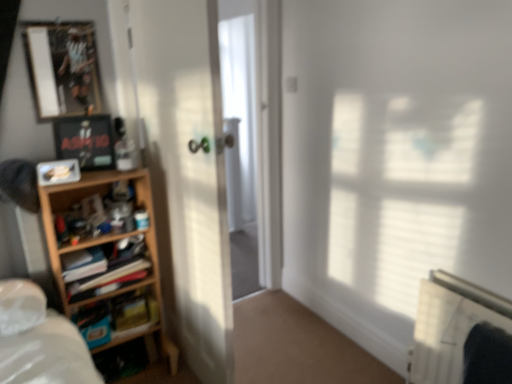
The height and width of the screenshot is (384, 512). Describe the element at coordinates (134, 311) in the screenshot. I see `hardcover book at left` at that location.

How much space does matte plastic picture frame at left, which ranks as the third picture frame in top-to-bottom order, occupy vertically?

It is 3.64 inches.

Identify the location of metallic silver picture frame at upper left, the first picture frame viewed from the top. The image size is (512, 384). (63, 68).

The image size is (512, 384). Describe the element at coordinates (63, 68) in the screenshot. I see `metallic silver picture frame at upper left, the first picture frame viewed from the top` at that location.

The image size is (512, 384). What do you see at coordinates (85, 141) in the screenshot?
I see `matte black picture frame at upper left, the second picture frame positioned from the bottom` at bounding box center [85, 141].

Where is `hardcover book at left`? This screenshot has width=512, height=384. hardcover book at left is located at coordinates (134, 311).

Is hardcover book at left oriented towards matte plastic picture frame at left, the 1th picture frame positioned from the bottom?

No, hardcover book at left is not aimed at matte plastic picture frame at left, the 1th picture frame positioned from the bottom.

Is hardcover book at left touching matte plastic picture frame at left, which ranks as the third picture frame in top-to-bottom order?

No, hardcover book at left is not touching matte plastic picture frame at left, which ranks as the third picture frame in top-to-bottom order.

Between hardcover book at left and matte plastic picture frame at left, which ranks as the third picture frame in top-to-bottom order, which one appears on the right side from the viewer's perspective?

Positioned to the right is hardcover book at left.

Looking at their sizes, would you say hardcover book at left is wider or thinner than matte plastic picture frame at left, the 1th picture frame positioned from the bottom?

Considering their sizes, hardcover book at left looks broader than matte plastic picture frame at left, the 1th picture frame positioned from the bottom.

Looking at this image, from the image's perspective, is metallic silver picture frame at upper left, the first picture frame viewed from the top, over matte plastic picture frame at left, the 1th picture frame positioned from the bottom?

Yes, from the image's perspective, metallic silver picture frame at upper left, the first picture frame viewed from the top, is over matte plastic picture frame at left, the 1th picture frame positioned from the bottom.

In terms of width, does metallic silver picture frame at upper left, the third picture frame positioned from the bottom, look wider or thinner when compared to matte plastic picture frame at left, the 1th picture frame positioned from the bottom?

In the image, metallic silver picture frame at upper left, the third picture frame positioned from the bottom, appears to be more narrow than matte plastic picture frame at left, the 1th picture frame positioned from the bottom.

Is metallic silver picture frame at upper left, the first picture frame viewed from the top, beside matte plastic picture frame at left, which ranks as the third picture frame in top-to-bottom order?

No, metallic silver picture frame at upper left, the first picture frame viewed from the top, is not in contact with matte plastic picture frame at left, which ranks as the third picture frame in top-to-bottom order.

Is metallic silver picture frame at upper left, the first picture frame viewed from the top, facing towards matte plastic picture frame at left, which ranks as the third picture frame in top-to-bottom order?

No.

Is white plastic radiator at lower right in contact with wooden shelf at left, which appears as the 2th shelf when ordered from the bottom?

No, white plastic radiator at lower right is not touching wooden shelf at left, which appears as the 2th shelf when ordered from the bottom.

Where is `shelf that is the 2nd object above the white plastic radiator at lower right (from a real-world perspective)`? Image resolution: width=512 pixels, height=384 pixels. shelf that is the 2nd object above the white plastic radiator at lower right (from a real-world perspective) is located at coordinates (112, 268).

Which is behind, point (445, 288) or point (78, 290)?

The point (78, 290) is farther.

Is white plastic radiator at lower right behind wooden shelf at left, the first shelf when ordered from top to bottom?

No, it is not.

Considering the sizes of objects hardcover book at left and metallic silver picture frame at upper left, the first picture frame viewed from the top, in the image provided, who is shorter, hardcover book at left or metallic silver picture frame at upper left, the first picture frame viewed from the top,?

hardcover book at left is shorter.

From the image's perspective, between hardcover book at left and metallic silver picture frame at upper left, the third picture frame positioned from the bottom, which one is located above?

From the image's view, metallic silver picture frame at upper left, the third picture frame positioned from the bottom, is above.

Can you confirm if hardcover book at left is smaller than metallic silver picture frame at upper left, the third picture frame positioned from the bottom?

Actually, hardcover book at left might be larger than metallic silver picture frame at upper left, the third picture frame positioned from the bottom.

Locate an element on the screen. paperback book below the metallic silver picture frame at upper left, the third picture frame positioned from the bottom (from a real-world perspective) is located at coordinates (134, 311).

Would you say hardcover book at left contains matte black picture frame at upper left, the second picture frame positioned from the bottom?

No, matte black picture frame at upper left, the second picture frame positioned from the bottom, is not a part of hardcover book at left.

Is hardcover book at left taller or shorter than matte black picture frame at upper left, acting as the 2th picture frame starting from the top?

hardcover book at left is shorter than matte black picture frame at upper left, acting as the 2th picture frame starting from the top.

Is hardcover book at left bigger than matte black picture frame at upper left, acting as the 2th picture frame starting from the top?

No, hardcover book at left is not bigger than matte black picture frame at upper left, acting as the 2th picture frame starting from the top.

Measure the distance from hardcover book at left to matte black picture frame at upper left, acting as the 2th picture frame starting from the top.

They are 28.87 inches apart.

Which object is wider, hardcover book at left or wooden shelf at left, the first shelf when ordered from top to bottom?

With larger width is wooden shelf at left, the first shelf when ordered from top to bottom.

From the picture: Is the depth of hardcover book at left less than that of wooden shelf at left, which appears as the 2th shelf when ordered from the bottom?

No, hardcover book at left is behind wooden shelf at left, which appears as the 2th shelf when ordered from the bottom.

Can you tell me how much hardcover book at left and wooden shelf at left, the first shelf when ordered from top to bottom, differ in facing direction?

The angle between the facing direction of hardcover book at left and the facing direction of wooden shelf at left, the first shelf when ordered from top to bottom, is 1.54 degrees.

From a real-world perspective, who is located lower, matte plastic picture frame at left, the 1th picture frame positioned from the bottom, or metallic silver picture frame at upper left, the third picture frame positioned from the bottom?

matte plastic picture frame at left, the 1th picture frame positioned from the bottom.

Is matte plastic picture frame at left, the 1th picture frame positioned from the bottom, to the left or to the right of metallic silver picture frame at upper left, the third picture frame positioned from the bottom, in the image?

In the image, matte plastic picture frame at left, the 1th picture frame positioned from the bottom, appears on the right side of metallic silver picture frame at upper left, the third picture frame positioned from the bottom.

Which is behind, point (39, 182) or point (67, 62)?

Positioned behind is point (67, 62).

Is matte plastic picture frame at left, the 1th picture frame positioned from the bottom, aimed at metallic silver picture frame at upper left, the third picture frame positioned from the bottom?

No, matte plastic picture frame at left, the 1th picture frame positioned from the bottom, is not aimed at metallic silver picture frame at upper left, the third picture frame positioned from the bottom.

There is a hardcover book at left. In order to click on the 1st picture frame above it (from the image's perspective) in this screenshot , I will do `click(58, 172)`.

The height and width of the screenshot is (384, 512). I want to click on the 1st picture frame behind the matte plastic picture frame at left, the 1th picture frame positioned from the bottom, starting your count from the anchor, so click(x=63, y=68).

Looking at the image, which one is located closer to hardcover book at left, white glossy screen door at center or wooden shelf at left, marked as the first shelf in a bottom-to-top arrangement?

Among the two, wooden shelf at left, marked as the first shelf in a bottom-to-top arrangement, is located nearer to hardcover book at left.

Estimate the real-world distances between objects in this image. Which object is closer to matte plastic picture frame at left, which ranks as the third picture frame in top-to-bottom order, white plastic radiator at lower right or matte black picture frame at upper left, acting as the 2th picture frame starting from the top?

matte black picture frame at upper left, acting as the 2th picture frame starting from the top.

Looking at this image, estimate the real-world distances between objects in this image. Which object is further from matte black picture frame at upper left, acting as the 2th picture frame starting from the top, matte plastic picture frame at left, which ranks as the third picture frame in top-to-bottom order, or wooden shelf at left, the first shelf when ordered from top to bottom?

wooden shelf at left, the first shelf when ordered from top to bottom, is positioned further to the anchor matte black picture frame at upper left, acting as the 2th picture frame starting from the top.

Based on their spatial positions, is hardcover book at left or white glossy screen door at center closer to matte plastic picture frame at left, which ranks as the third picture frame in top-to-bottom order?

Among the two, white glossy screen door at center is located nearer to matte plastic picture frame at left, which ranks as the third picture frame in top-to-bottom order.

Estimate the real-world distances between objects in this image. Which object is closer to white glossy screen door at center, metallic silver picture frame at upper left, the third picture frame positioned from the bottom, or matte black picture frame at upper left, the second picture frame positioned from the bottom?

Based on the image, matte black picture frame at upper left, the second picture frame positioned from the bottom, appears to be nearer to white glossy screen door at center.

Looking at the image, which one is located further to white glossy screen door at center, matte plastic picture frame at left, the 1th picture frame positioned from the bottom, or white plastic radiator at lower right?

white plastic radiator at lower right is positioned further to the anchor white glossy screen door at center.

When comparing their distances from hardcover book at left, does wooden shelf at left, which appears as the 2th shelf when ordered from the bottom, or white glossy screen door at center seem closer?

wooden shelf at left, which appears as the 2th shelf when ordered from the bottom, lies closer to hardcover book at left than the other object.

Estimate the real-world distances between objects in this image. Which object is further from hardcover book at left, white plastic radiator at lower right or white glossy screen door at center?

Among the two, white plastic radiator at lower right is located further to hardcover book at left.

Locate an element on the screen. paperback book between matte black picture frame at upper left, the second picture frame positioned from the bottom, and white plastic radiator at lower right from left to right is located at coordinates (134, 311).

Identify the location of paperback book between wooden shelf at left, marked as the first shelf in a bottom-to-top arrangement, and white plastic radiator at lower right, in the horizontal direction. (134, 311).

Locate an element on the screen. The width and height of the screenshot is (512, 384). picture frame between metallic silver picture frame at upper left, the third picture frame positioned from the bottom, and matte plastic picture frame at left, the 1th picture frame positioned from the bottom, in the vertical direction is located at coordinates (85, 141).

Where is `screen door between metallic silver picture frame at upper left, the first picture frame viewed from the top, and hardcover book at left vertically`? This screenshot has width=512, height=384. screen door between metallic silver picture frame at upper left, the first picture frame viewed from the top, and hardcover book at left vertically is located at coordinates (187, 173).